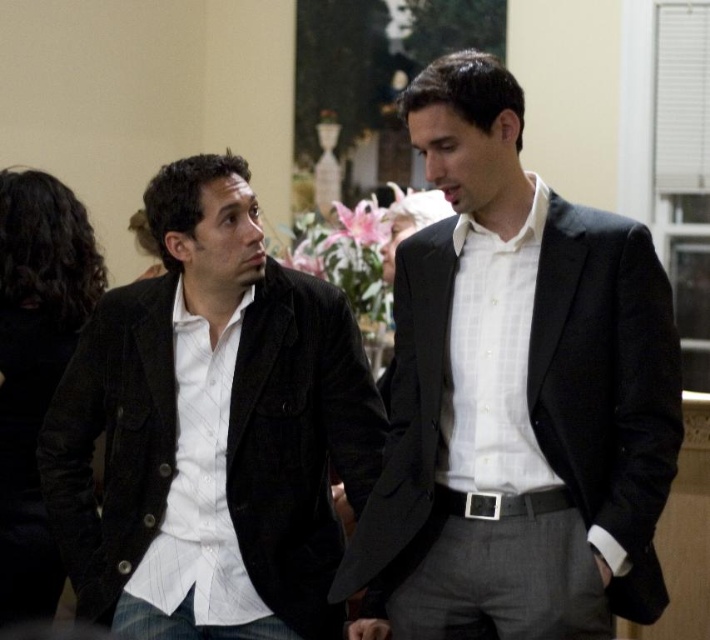
Who is more distant from viewer, (568, 435) or (131, 285)?

The point (131, 285) is behind.

Measure the distance from matte black suit at center to matte black jacket at left.

The distance of matte black suit at center from matte black jacket at left is 21.10 inches.

Find the location of a particular element. The width and height of the screenshot is (710, 640). matte black suit at center is located at coordinates (518, 394).